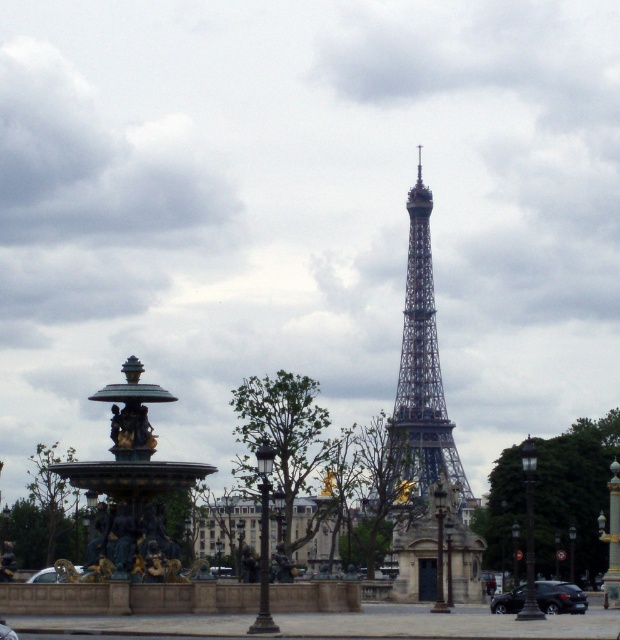
Can you confirm if shiny steel eiffel tower at center is positioned below shiny black car at lower right?

Actually, shiny steel eiffel tower at center is above shiny black car at lower right.

Who is more distant from viewer, [445,426] or [536,595]?

Positioned behind is point [445,426].

Who is more forward, (432, 288) or (544, 608)?

Point (544, 608) is more forward.

The height and width of the screenshot is (640, 620). Identify the location of shiny steel eiffel tower at center. (423, 364).

Which of these two, shiny steel eiffel tower at center or metallic silver car at lower left, stands taller?

shiny steel eiffel tower at center is taller.

Does point (436, 348) come in front of point (43, 572)?

That is False.

Image resolution: width=620 pixels, height=640 pixels. I want to click on shiny steel eiffel tower at center, so point(423,364).

Does metallic silver car at lower left appear on the left side of shiny silver car at center?

Correct, you'll find metallic silver car at lower left to the left of shiny silver car at center.

Is metallic silver car at lower left above shiny silver car at center?

No.

Measure the distance between point [43,580] and camera.

A distance of 311.64 meters exists between point [43,580] and camera.

At what (x,y) coordinates should I click in order to perform the action: click on metallic silver car at lower left. Please return your answer as a coordinate pair (x, y). The image size is (620, 640). Looking at the image, I should click on (43, 576).